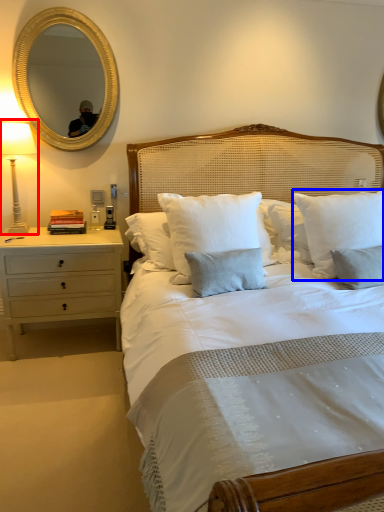
Question: Which object appears closest to the camera in this image, bedside lamp (highlighted by a red box) or pillow (highlighted by a blue box)?

Choices:
 (A) bedside lamp
 (B) pillow

Answer: (B)